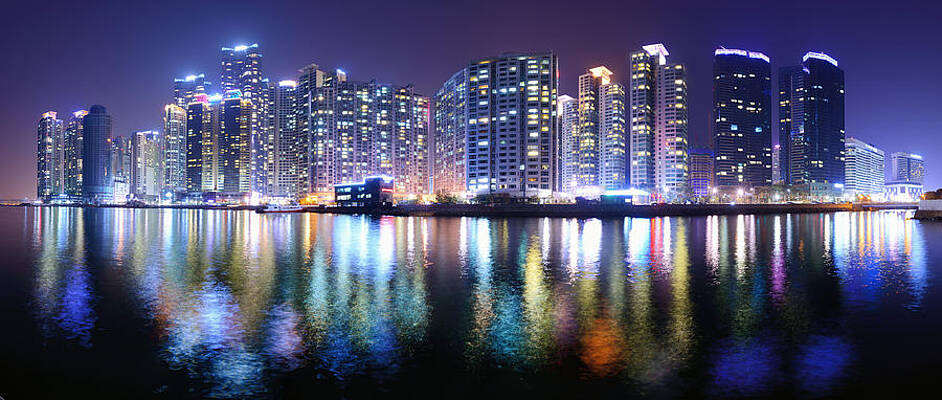
Identify the location of red lights. (603, 347), (655, 244).